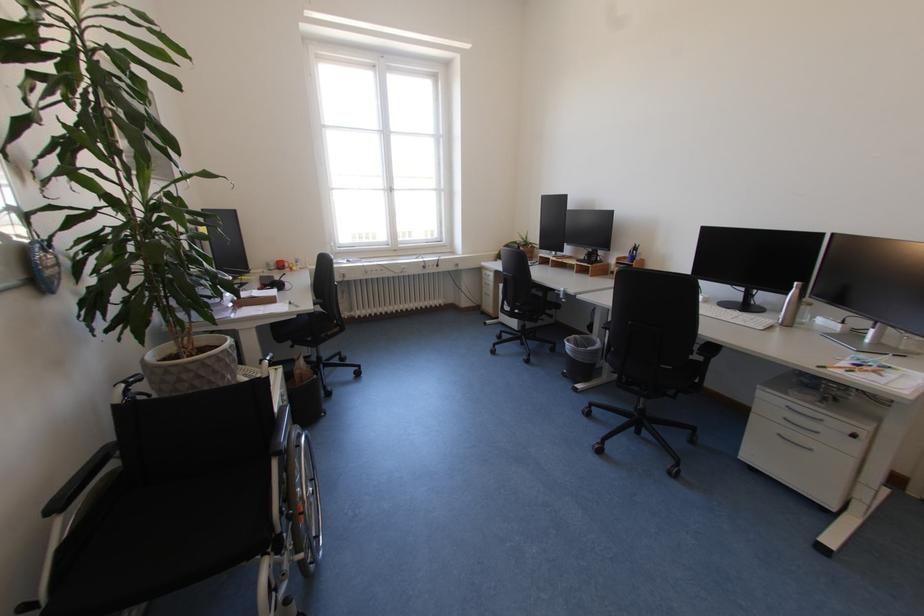
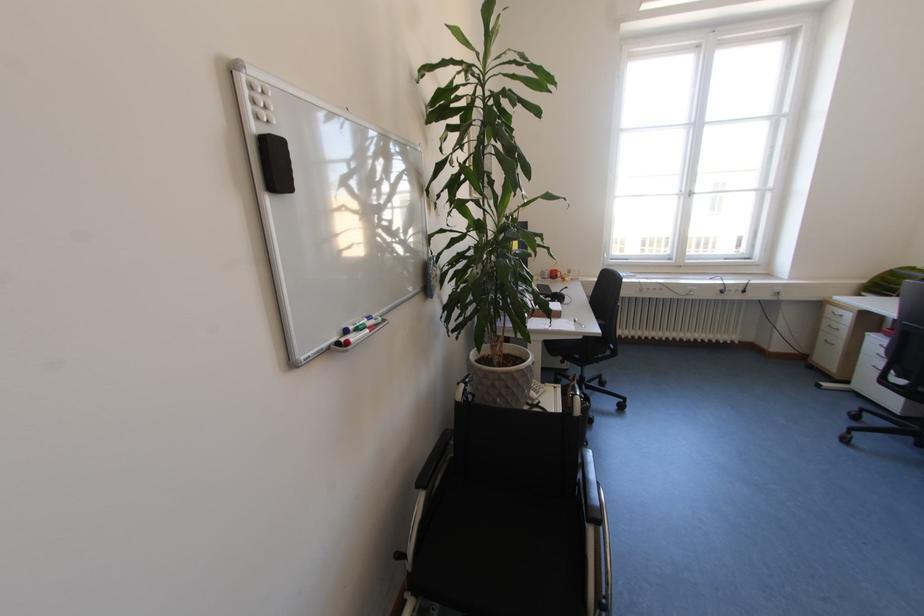
Locate, in the second image, the point that corresponds to the point at 304,318 in the first image.

(589, 339)